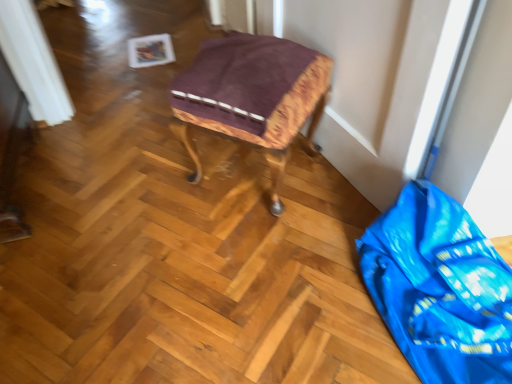
Question: Is wooden stool at center thinner than blue shiny plastic bag at lower right?

Choices:
 (A) yes
 (B) no

Answer: (A)

Question: Is wooden stool at center directly adjacent to blue shiny plastic bag at lower right?

Choices:
 (A) no
 (B) yes

Answer: (A)

Question: Is wooden stool at center to the left of blue shiny plastic bag at lower right from the viewer's perspective?

Choices:
 (A) no
 (B) yes

Answer: (B)

Question: Can you confirm if wooden stool at center is taller than blue shiny plastic bag at lower right?

Choices:
 (A) yes
 (B) no

Answer: (A)

Question: Is wooden stool at center positioned behind blue shiny plastic bag at lower right?

Choices:
 (A) yes
 (B) no

Answer: (A)

Question: From a real-world perspective, is wooden stool at center physically above blue shiny plastic bag at lower right?

Choices:
 (A) yes
 (B) no

Answer: (A)

Question: Could wooden stool at center be considered to be inside blue shiny plastic bag at lower right?

Choices:
 (A) no
 (B) yes

Answer: (A)

Question: Does blue shiny plastic bag at lower right come behind wooden stool at center?

Choices:
 (A) no
 (B) yes

Answer: (A)

Question: Does blue shiny plastic bag at lower right come in front of wooden stool at center?

Choices:
 (A) no
 (B) yes

Answer: (B)

Question: From a real-world perspective, is blue shiny plastic bag at lower right on top of wooden stool at center?

Choices:
 (A) yes
 (B) no

Answer: (B)

Question: Considering the relative sizes of blue shiny plastic bag at lower right and wooden stool at center in the image provided, is blue shiny plastic bag at lower right thinner than wooden stool at center?

Choices:
 (A) yes
 (B) no

Answer: (B)

Question: Is blue shiny plastic bag at lower right beside wooden stool at center?

Choices:
 (A) yes
 (B) no

Answer: (B)

Question: From a real-world perspective, is wooden stool at center positioned above or below blue shiny plastic bag at lower right?

Choices:
 (A) below
 (B) above

Answer: (B)